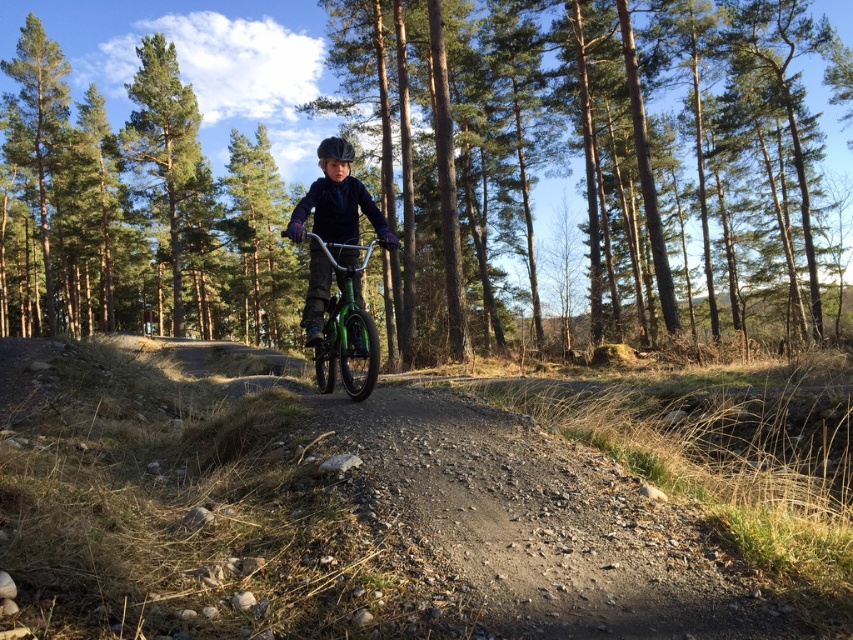
Question: Is green metallic bicycle at center smaller than matte black helmet at center?

Choices:
 (A) no
 (B) yes

Answer: (A)

Question: Does green metallic mountain bike at center have a larger size compared to matte black helmet at center?

Choices:
 (A) yes
 (B) no

Answer: (B)

Question: Can you confirm if green metallic bicycle at center is positioned above green metallic mountain bike at center?

Choices:
 (A) no
 (B) yes

Answer: (B)

Question: Estimate the real-world distances between objects in this image. Which object is farther from the green metallic bicycle at center?

Choices:
 (A) green metallic mountain bike at center
 (B) green matte tree at upper left
 (C) matte black helmet at center

Answer: (A)

Question: Which object is farther from the camera taking this photo?

Choices:
 (A) green metallic mountain bike at center
 (B) matte black helmet at center
 (C) green metallic bicycle at center

Answer: (C)

Question: Estimate the real-world distances between objects in this image. Which object is closer to the matte black helmet at center?

Choices:
 (A) green metallic bicycle at center
 (B) green metallic mountain bike at center

Answer: (B)